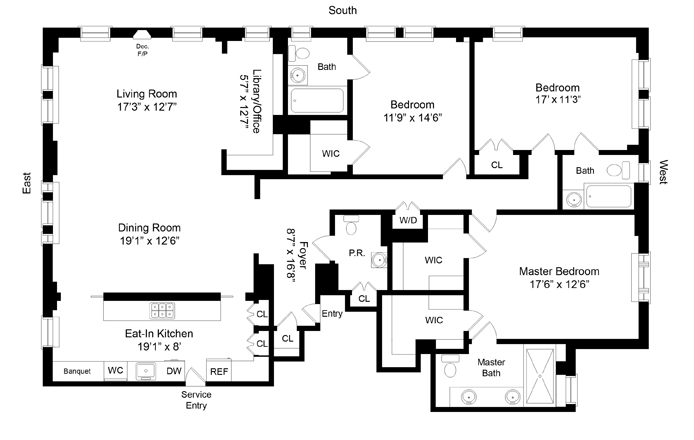
Identify the location of floor plans. (345, 380).